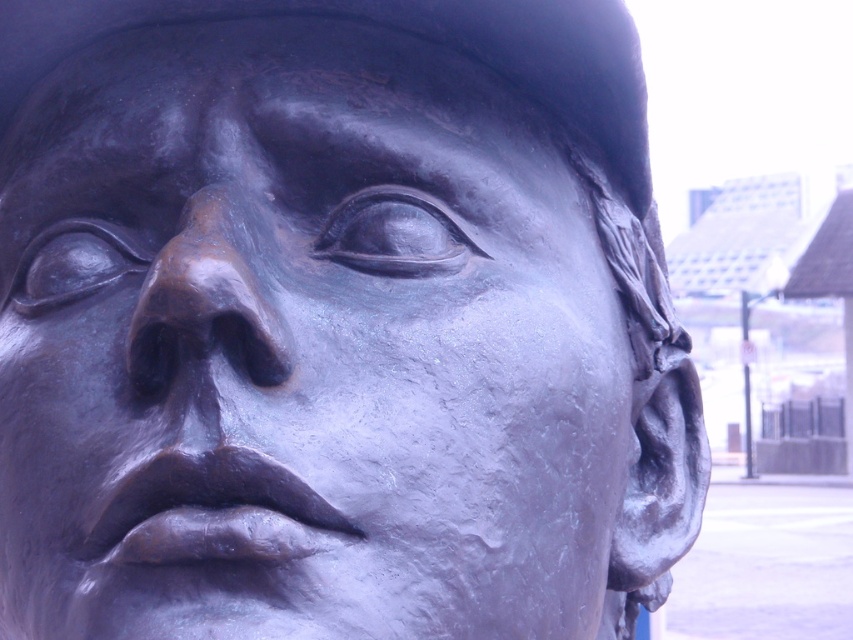
Who is shorter, bronze sculpture at center or bronze textured nose at center?

bronze textured nose at center is shorter.

Is point (225, 554) closer to viewer compared to point (241, 349)?

Yes, point (225, 554) is in front of point (241, 349).

At what (x,y) coordinates should I click in order to perform the action: click on bronze sculpture at center. Please return your answer as a coordinate pair (x, y). Image resolution: width=853 pixels, height=640 pixels. Looking at the image, I should click on (300, 348).